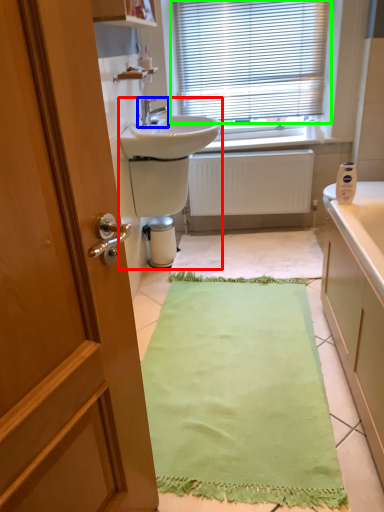
Question: Considering the real-world distances, which object is closest to sink (highlighted by a red box)? tap (highlighted by a blue box) or window blind (highlighted by a green box).

Choices:
 (A) tap
 (B) window blind

Answer: (A)